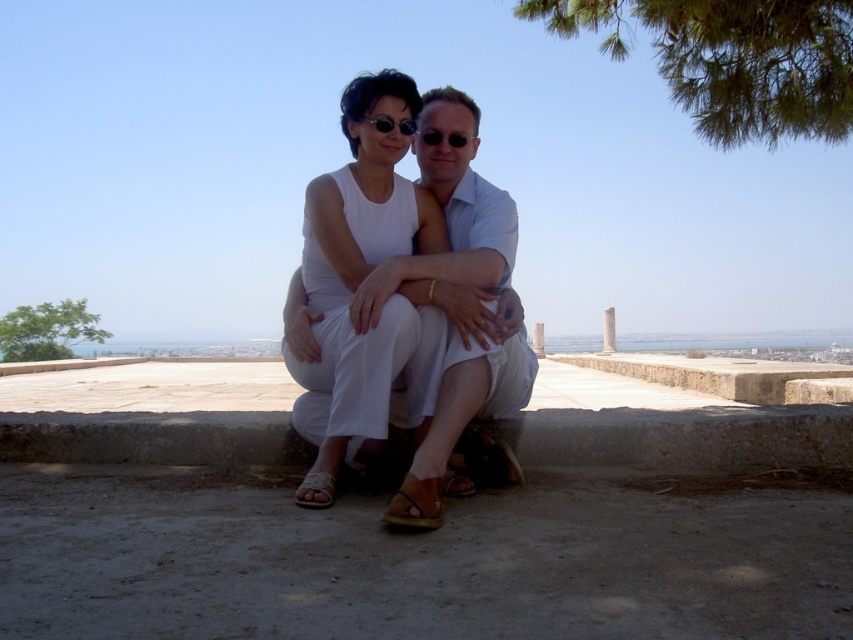
Question: Based on their relative distances, which object is nearer to the matte black sunglasses at center?

Choices:
 (A) brown leather sandal at lower center
 (B) white cotton dress at center

Answer: (B)

Question: Which of the following is the closest to the observer?

Choices:
 (A) (508, 385)
 (B) (312, 480)
 (C) (434, 476)

Answer: (C)

Question: Can you confirm if leather sandal at lower center is wider than matte black sunglasses at center?

Choices:
 (A) yes
 (B) no

Answer: (B)

Question: Which point is closer to the camera taking this photo?

Choices:
 (A) (308, 500)
 (B) (422, 129)
 (C) (408, 496)
 (D) (491, 248)

Answer: (C)

Question: Can you confirm if white cotton dress at center is positioned above brown leather sandal at lower center?

Choices:
 (A) yes
 (B) no

Answer: (A)

Question: Is white cotton dress at center closer to the viewer compared to brown leather sandal at lower center?

Choices:
 (A) no
 (B) yes

Answer: (A)